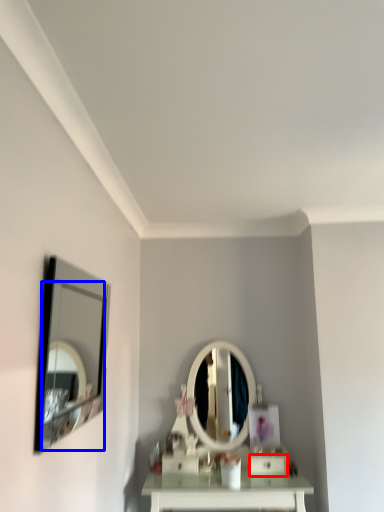
Question: Among these objects, which one is nearest to the camera, drawer (highlighted by a red box) or mirror (highlighted by a blue box)?

Choices:
 (A) drawer
 (B) mirror

Answer: (B)